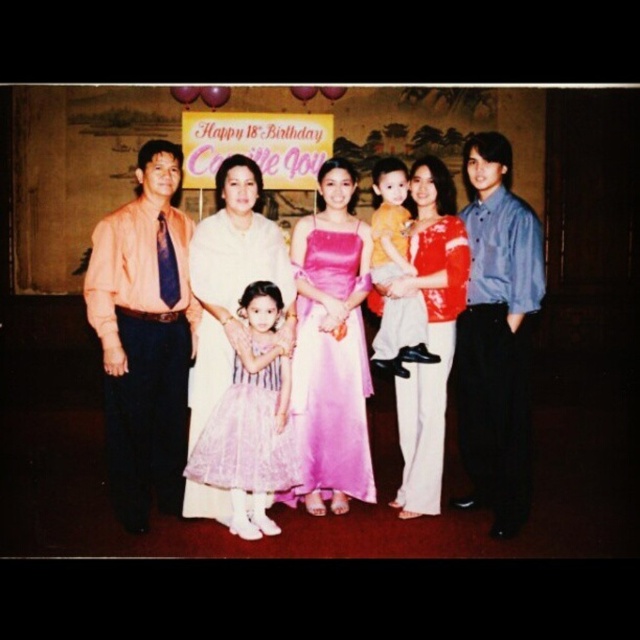
Question: Estimate the real-world distances between objects in this image. Which object is farther from the blue shirt at right?

Choices:
 (A) matte white blouse at center
 (B) matte orange shirt at left
 (C) yellow fabric shirt at center
 (D) pink satin dress at center

Answer: (B)

Question: Which object is the farthest from the blue shirt at right?

Choices:
 (A) yellow fabric shirt at center
 (B) pink satin dress at center
 (C) matte pink dress at center
 (D) satin pink dress at center

Answer: (D)

Question: Is pink satin dress at center closer to camera compared to matte pink dress at center?

Choices:
 (A) no
 (B) yes

Answer: (B)

Question: Is matte pink dress at center in front of yellow fabric shirt at center?

Choices:
 (A) no
 (B) yes

Answer: (B)

Question: Which object is farther from the camera taking this photo?

Choices:
 (A) matte white blouse at center
 (B) matte orange shirt at left
 (C) matte pink dress at center

Answer: (C)

Question: Can you confirm if blue shirt at right is wider than matte pink dress at center?

Choices:
 (A) no
 (B) yes

Answer: (A)